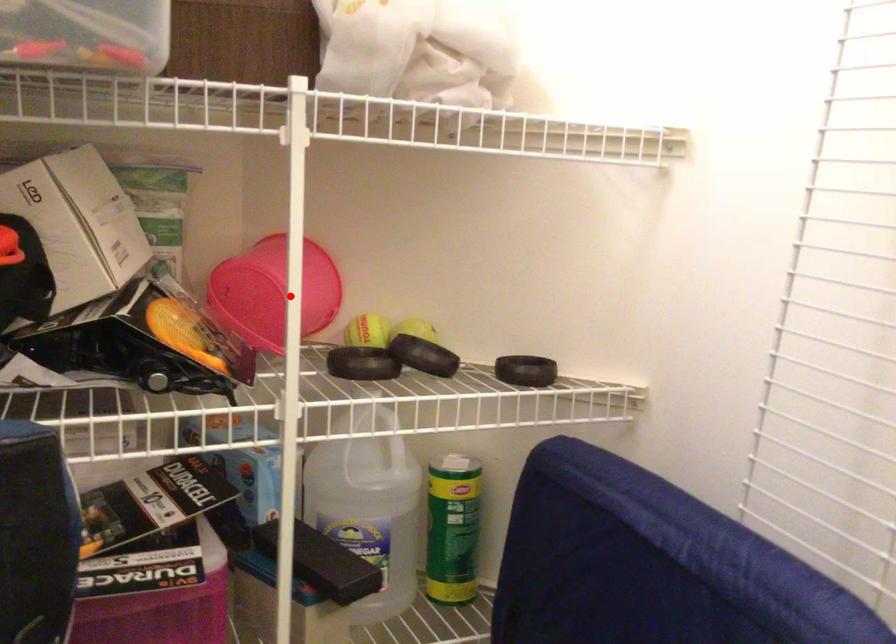
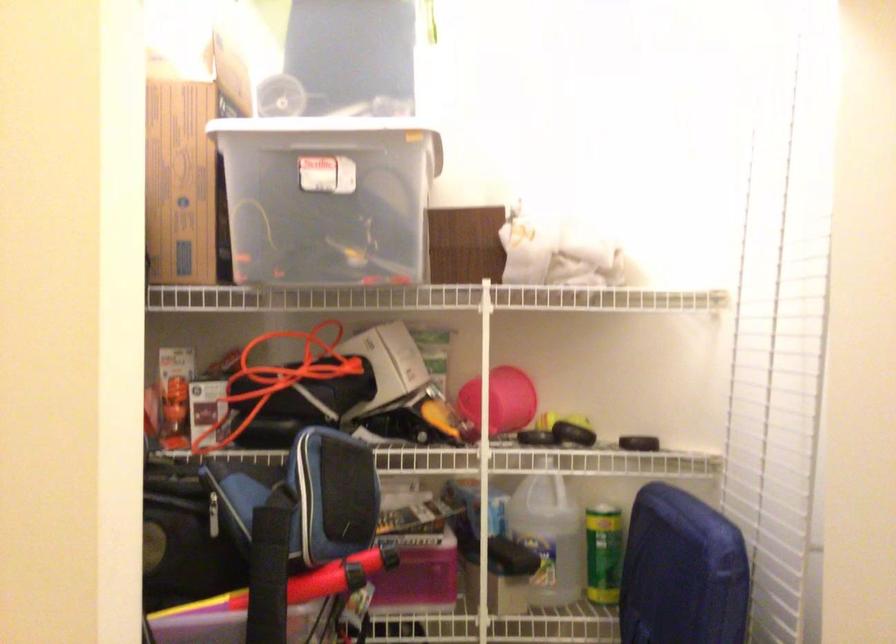
Question: I am providing you with two images of the same scene from different viewpoints. Given a red point in image1, look at the same physical point in image2. Is it:

Choices:
 (A) Closer to the viewpoint
 (B) Farther from the viewpoint

Answer: (B)